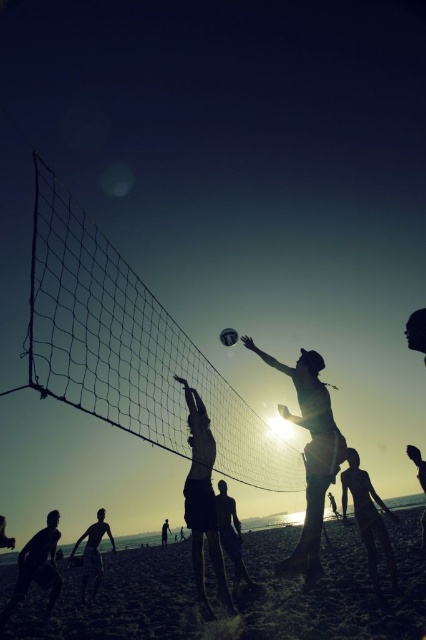
Between point (8, 611) and point (238, 566), which one is positioned behind?

The point (238, 566) is behind.

Can you confirm if silhouette running man at lower left is taller than silhouette sand at center?

Yes, silhouette running man at lower left is taller than silhouette sand at center.

Which is behind, point (42, 547) or point (221, 490)?

Point (221, 490)

The image size is (426, 640). In order to click on silhouette running man at lower left in this screenshot , I will do `click(37, 566)`.

Can you confirm if dark skin human at center is positioned below white matte volleyball at center?

Yes, dark skin human at center is below white matte volleyball at center.

From the picture: Is dark skin human at center taller than white matte volleyball at center?

Correct, dark skin human at center is much taller as white matte volleyball at center.

The image size is (426, 640). What do you see at coordinates (92, 554) in the screenshot?
I see `dark skin human at center` at bounding box center [92, 554].

You are a GUI agent. You are given a task and a screenshot of the screen. Output one action in this format:
    pyautogui.click(x=<x>, y=<y>)
    Task: Click on the dark skin human at center
    The width and height of the screenshot is (426, 640).
    Given the screenshot: What is the action you would take?
    pyautogui.click(x=92, y=554)

Who is higher up, smooth sand beach at lower center or silhouette sand volleyball player at center?

silhouette sand volleyball player at center

Where is `smooth sand beach at lower center`? smooth sand beach at lower center is located at coordinates (336, 588).

Who is more forward, (x=23, y=618) or (x=313, y=490)?

Point (x=313, y=490)

Identify the location of smooth sand beach at lower center. The width and height of the screenshot is (426, 640). (336, 588).